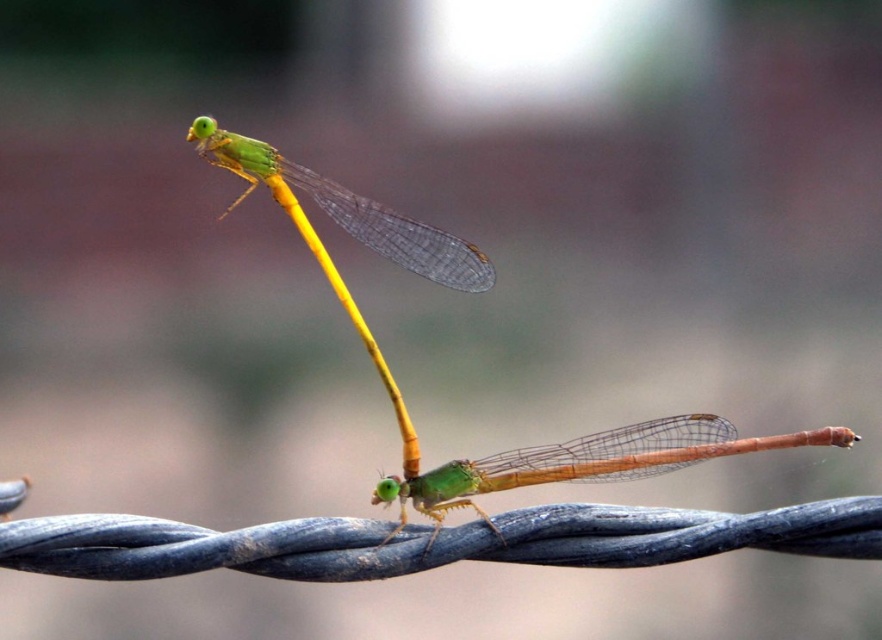
Question: Where is green translucent wings at upper left located in relation to translucent yellow stem at center in the image?

Choices:
 (A) right
 (B) left

Answer: (B)

Question: Which object is the farthest from the green translucent wings at center?

Choices:
 (A) metallic wire at center
 (B) translucent yellow stem at center
 (C) green translucent wings at upper left

Answer: (C)

Question: Among these objects, which one is nearest to the camera?

Choices:
 (A) green translucent wings at center
 (B) translucent yellow stem at center

Answer: (A)

Question: Is green translucent wings at center above translucent yellow stem at center?

Choices:
 (A) yes
 (B) no

Answer: (B)

Question: Which object is positioned closest to the metallic wire at center?

Choices:
 (A) translucent yellow stem at center
 (B) green translucent wings at center

Answer: (B)

Question: Is green translucent wings at upper left to the right of translucent yellow stem at center from the viewer's perspective?

Choices:
 (A) yes
 (B) no

Answer: (B)